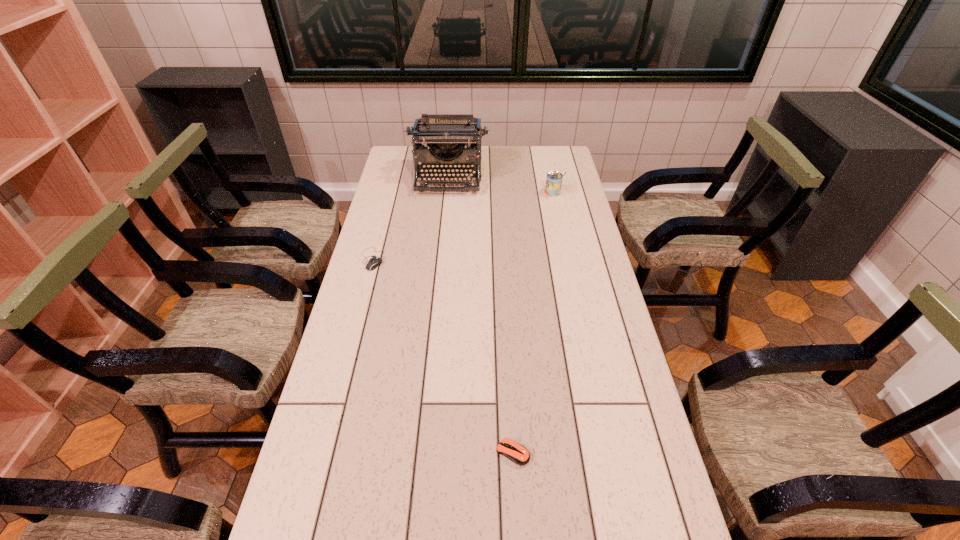
Locate an element on the screen. free location located on the back of the nearer computer mouse is located at coordinates (508, 350).

Locate an element on the screen. Image resolution: width=960 pixels, height=540 pixels. object that is at the far edge is located at coordinates (446, 135).

Find the location of `typewriter at the left edge`. typewriter at the left edge is located at coordinates (446, 135).

I want to click on computer mouse present at the left edge, so click(x=372, y=264).

This screenshot has height=540, width=960. In order to click on object situated at the right edge in this screenshot , I will do `click(554, 178)`.

Find the location of a particular element. object positioned at the far left corner is located at coordinates (446, 135).

This screenshot has height=540, width=960. Identify the location of vacant region at the far edge of the desktop. (525, 157).

In the image, there is a desktop. At what (x,y) coordinates should I click in order to perform the action: click on vacant space at the left edge. Please return your answer as a coordinate pair (x, y). Looking at the image, I should click on (403, 229).

At what (x,y) coordinates should I click in order to perform the action: click on free space at the right edge of the desktop. Please return your answer as a coordinate pair (x, y). Looking at the image, I should click on (580, 320).

Identify the location of vacant area at the far left corner. This screenshot has width=960, height=540. (393, 156).